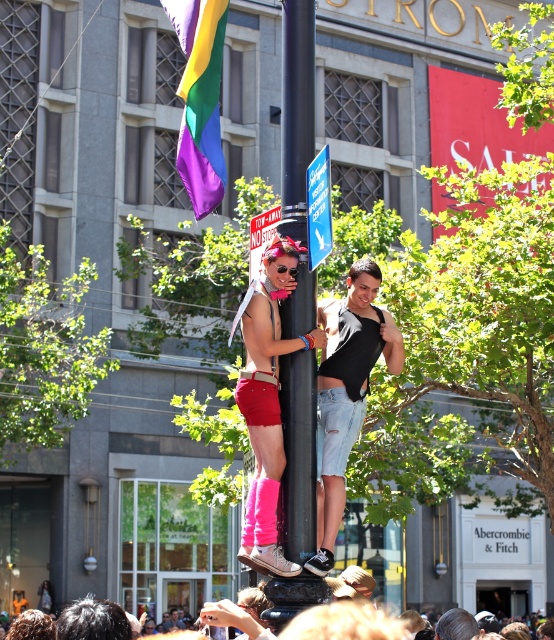
You are a photographer trying to capture the blue plastic sign at upper center and the metallic pole at center in your shot. Which object should you focus on first if you want to ensure both are in focus without adjusting your camera settings?

You should focus on the metallic pole at center first because it is farther away from the viewer than the blue plastic sign at upper center, so by focusing on the farther object, both will be in focus if the depth of field is sufficient.

Looking at this image, you are standing at the viewpoint of the image and want to reach the point marked as point [310,369]. Is this point within a safe walking distance of 30 meters?

The distance between the viewer and point [310,369] is 26.60 meters, which is within the 30 meters safe walking distance. Yes, it is within the safe distance.

You are a city planner analyzing the urban layout. Given the black metal pole at center and the brown hair at lower center, which object is taller?

The black metal pole at center is taller than the brown hair at lower center.